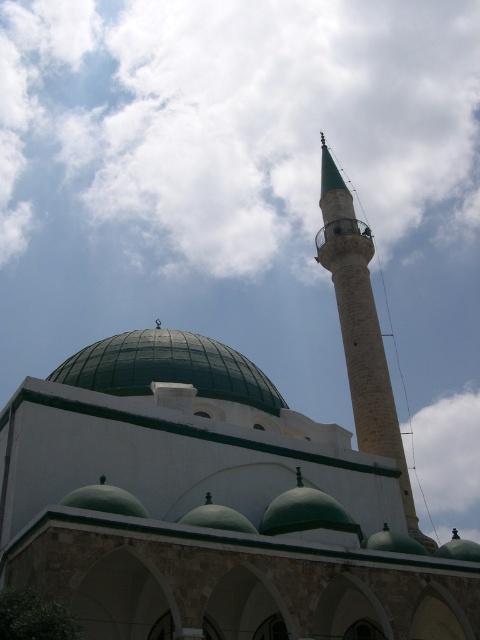
Question: Is cloudy sky at upper center positioned behind green matte dome at center?

Choices:
 (A) yes
 (B) no

Answer: (A)

Question: Estimate the real-world distances between objects in this image. Which object is closer to the green stone minaret at upper right?

Choices:
 (A) cloudy sky at upper center
 (B) green matte dome at center

Answer: (B)

Question: Among these objects, which one is nearest to the camera?

Choices:
 (A) cloudy sky at upper center
 (B) green matte dome at center
 (C) green stone minaret at upper right

Answer: (B)

Question: Observing the image, what is the correct spatial positioning of green stone minaret at upper right in reference to green matte dome at center?

Choices:
 (A) above
 (B) below

Answer: (A)

Question: Is cloudy sky at upper center to the right of green stone minaret at upper right from the viewer's perspective?

Choices:
 (A) yes
 (B) no

Answer: (B)

Question: Which of the following is the closest to the observer?

Choices:
 (A) green matte dome at center
 (B) cloudy sky at upper center
 (C) green stone minaret at upper right

Answer: (A)